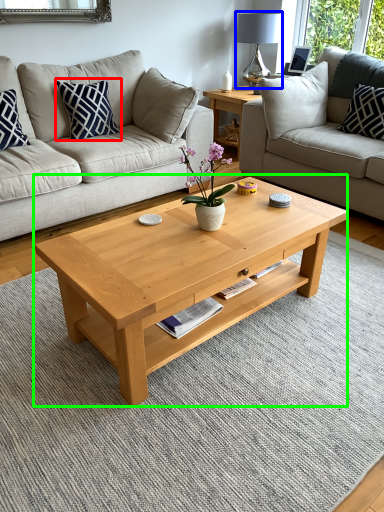
Question: Which object is the closest to the pillow (highlighted by a red box)? Choose among these: lamp (highlighted by a blue box) or coffee table (highlighted by a green box).

Choices:
 (A) lamp
 (B) coffee table

Answer: (B)